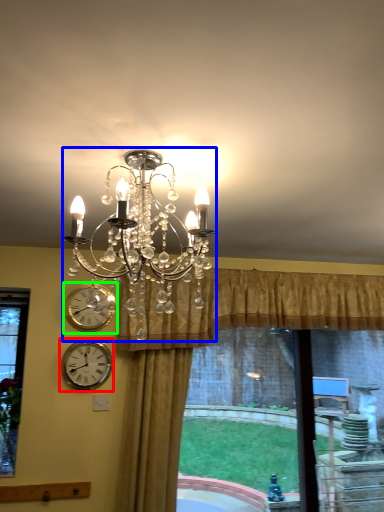
Question: Which is farther away from wall clock (highlighted by a red box)? lamp (highlighted by a blue box) or wall clock (highlighted by a green box)?

Choices:
 (A) lamp
 (B) wall clock

Answer: (A)